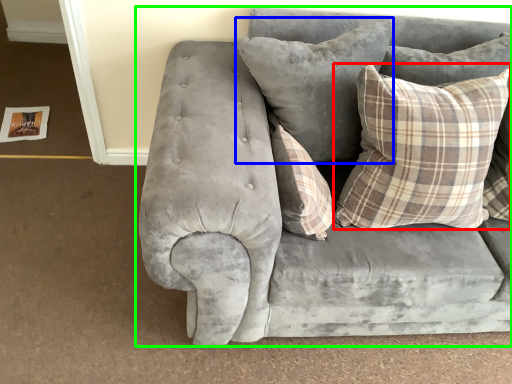
Question: Which object is positioned farthest from pillow (highlighted by a red box)? Select from pillow (highlighted by a blue box) and studio couch (highlighted by a green box).

Choices:
 (A) pillow
 (B) studio couch

Answer: (B)